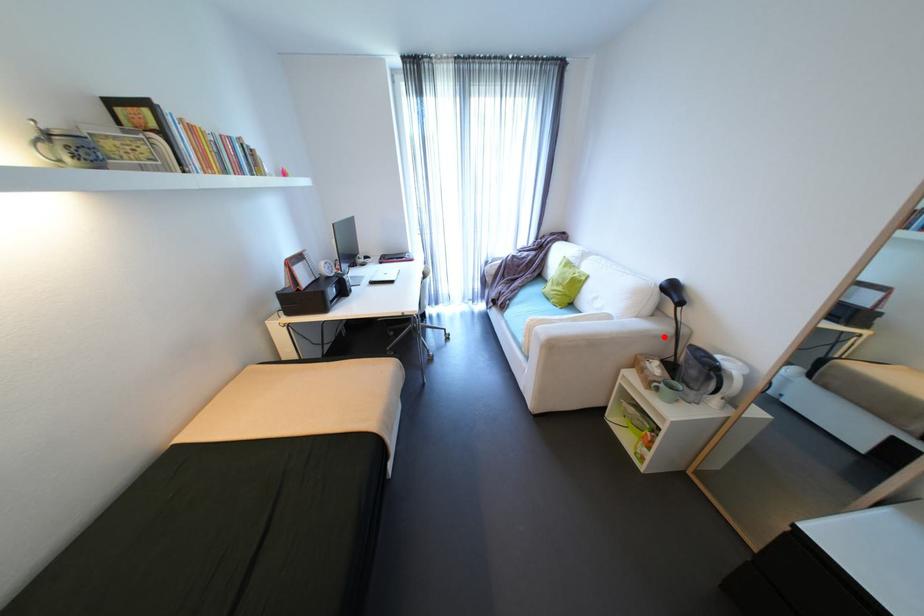
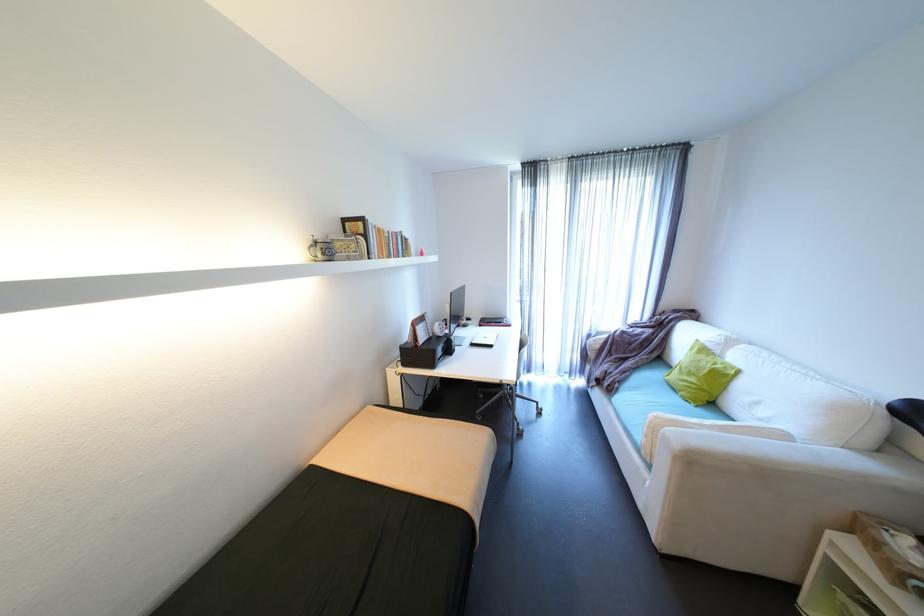
Where in the second image is the point corresponding to the highlighted location from the first image?

(907, 493)